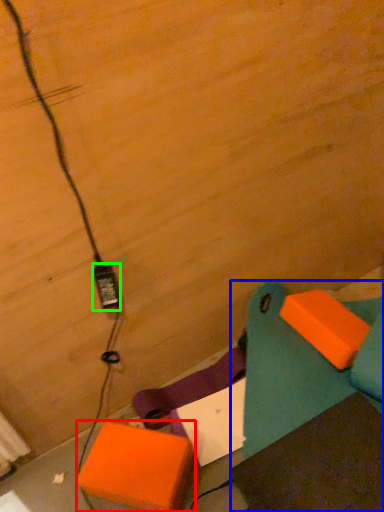
Question: Considering the real-world distances, which object is farthest from cardboard box (highlighted by a red box)? furniture (highlighted by a blue box) or power plugs and sockets (highlighted by a green box)?

Choices:
 (A) furniture
 (B) power plugs and sockets

Answer: (B)